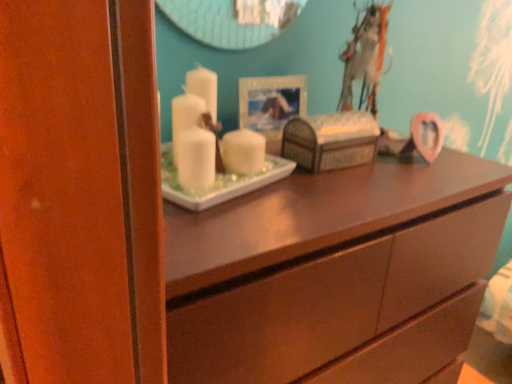
Describe the element at coordinates (324, 264) in the screenshot. The width and height of the screenshot is (512, 384). I see `matte brown chest of drawers at center` at that location.

Locate an element on the screen. The image size is (512, 384). matte brown chest of drawers at center is located at coordinates (324, 264).

At what (x,y) coordinates should I click in order to perform the action: click on matte brown chest of drawers at center. Please return your answer as a coordinate pair (x, y). Looking at the image, I should click on (324, 264).